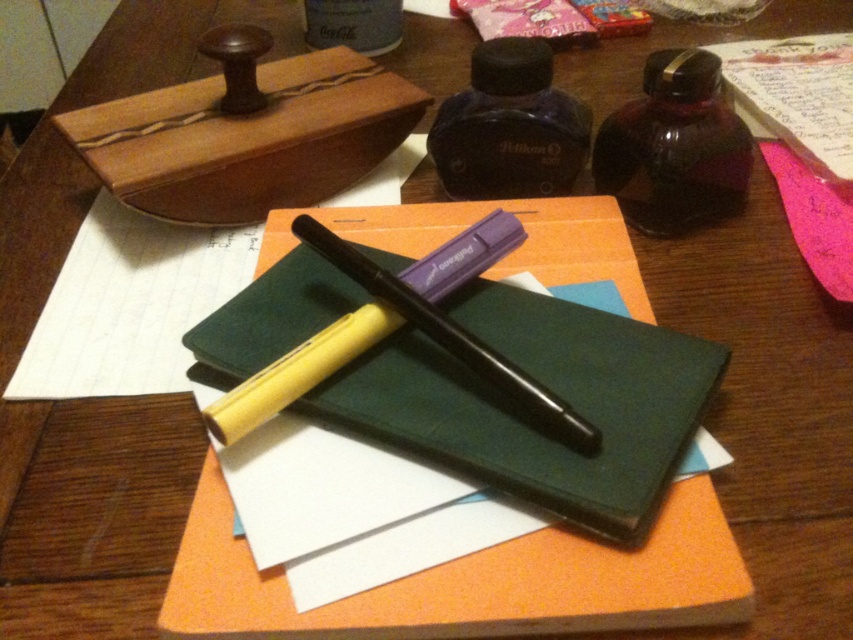
You are looking at the desk setup and want to place a small sticker exactly halfway between the two points, point [492,166] and point [258,408]. Considering their depth positions, will the sticker appear closer to the camera or further away compared to the average depth of the two points?

The sticker placed halfway between point [492,166] and point [258,408] will appear closer to the camera than the average depth because point [492,166] is further to the camera than point [258,408]. Since the sticker is halfway in position, its depth is closer to the closer point [258,408], making it nearer to the camera than the average depth of both points.

You are organizing your desk and want to place the green matte notebook at center and the matte black bottle at upper center into a drawer. Which object should you move first to access the other?

You should move the green matte notebook at center first because it is positioned on the right side of the matte black bottle at upper center, meaning the notebook is covering part of the bottle, so moving it first would allow access to the bottle.

You are organizing a desk and need to place a new item between the translucent amber bottle at upper right and the black plastic pen at center. Is there enough space to fit a 6.5 inch long ruler between them?

The distance between the translucent amber bottle at upper right and the black plastic pen at center is 7.33 inches, so yes, a 6.5 inch ruler can fit between them since it is shorter than the available space.